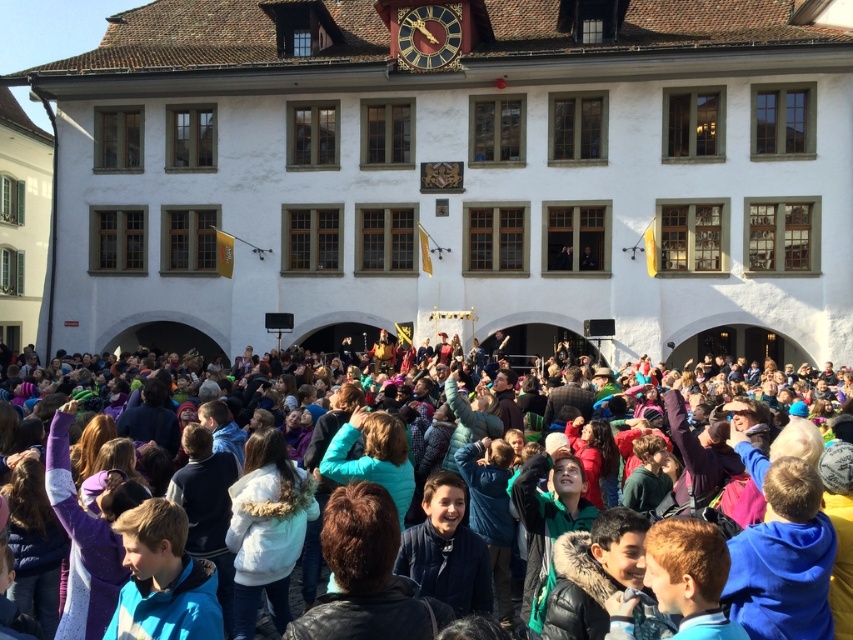
Can you confirm if multicolored clothing at center is shorter than gold-gilded wooden clock at upper center?

In fact, multicolored clothing at center may be taller than gold-gilded wooden clock at upper center.

Can you confirm if multicolored clothing at center is positioned to the right of gold-gilded wooden clock at upper center?

No, multicolored clothing at center is not to the right of gold-gilded wooden clock at upper center.

Locate an element on the screen. This screenshot has height=640, width=853. multicolored clothing at center is located at coordinates (244, 524).

Image resolution: width=853 pixels, height=640 pixels. Find the location of `multicolored clothing at center`. multicolored clothing at center is located at coordinates (244, 524).